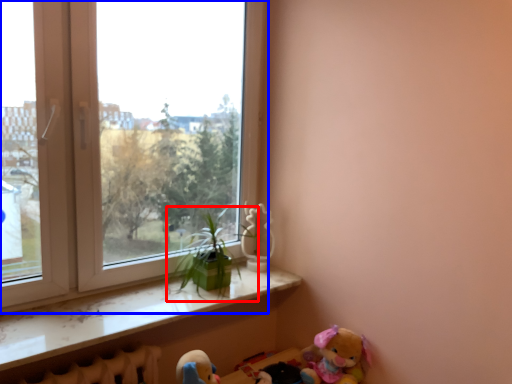
Question: Which object appears closest to the camera in this image, houseplant (highlighted by a red box) or window (highlighted by a blue box)?

Choices:
 (A) houseplant
 (B) window

Answer: (B)